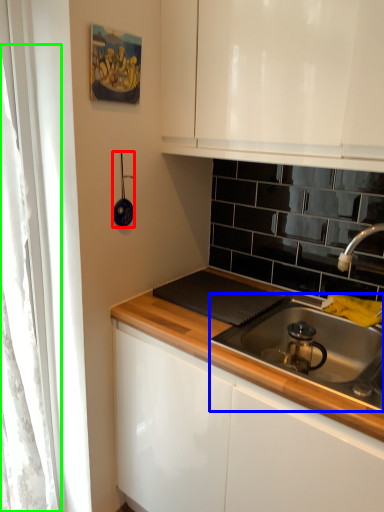
Question: Based on their relative distances, which object is nearer to appliance (highlighted by a red box)? Choose from gas stove (highlighted by a blue box) and curtain (highlighted by a green box).

Choices:
 (A) gas stove
 (B) curtain

Answer: (B)